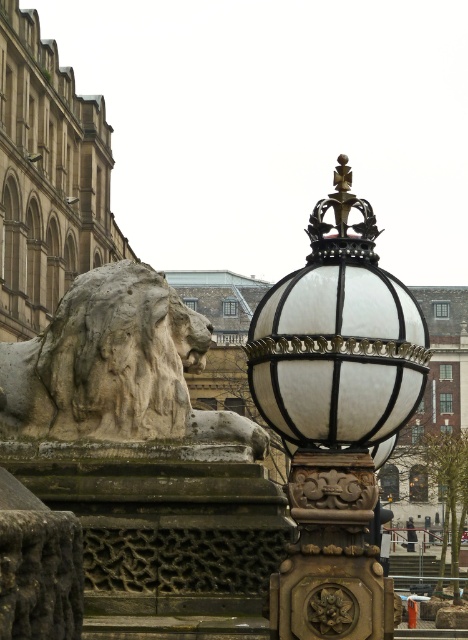
You are standing on the sidewalk in front of the historic building and want to take a photo of both the white glass lamp post at center and the stone lion at left. Which object should you position closer to the camera to ensure both are in focus?

You should position the camera closer to the white glass lamp post at center because it is in front of the stone lion at left, so focusing on it will help both objects be in focus simultaneously.

You are an architect inspecting the historic building. You notice the white glass lamp post at center and the stone lion at left. Based on their positions, which one is closer to the ground?

The white glass lamp post at center is closer to the ground because it is positioned below the stone lion at left.

You are an artist planning to sketch the scene. You want to ensure the proportions between the white glass lamp post at center and the stone lion at left are accurate. Which object should you draw first to maintain proper scale?

You should draw the white glass lamp post at center first since it is larger than the stone lion at left, allowing you to establish the correct scale relationship between them.